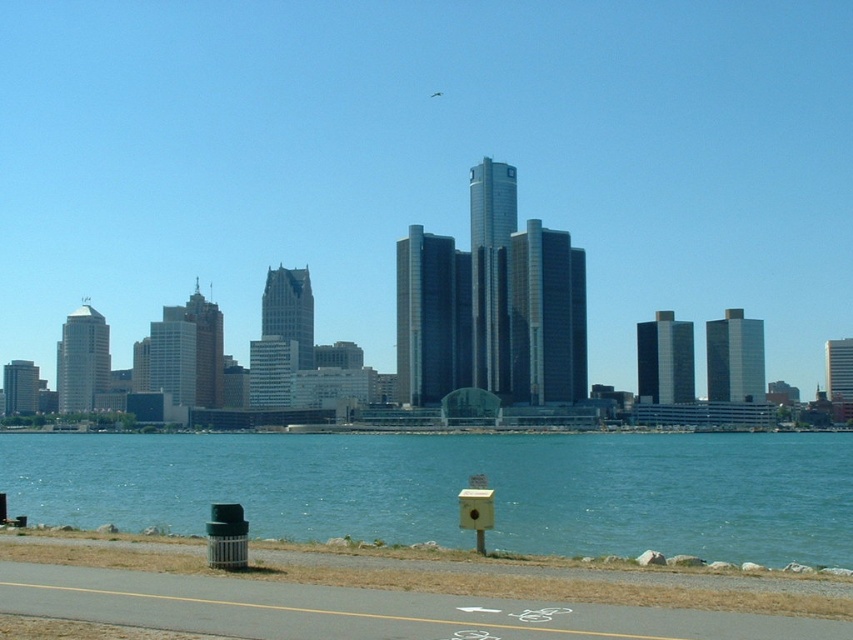
Question: Among these points, which one is farthest from the camera?

Choices:
 (A) (244, 616)
 (B) (270, 522)

Answer: (B)

Question: Is blue water at lower center to the left of gray asphalt bike path at lower center from the viewer's perspective?

Choices:
 (A) no
 (B) yes

Answer: (A)

Question: Which of the following is the closest to the observer?

Choices:
 (A) (573, 529)
 (B) (302, 614)

Answer: (B)

Question: Does blue water at lower center lie in front of gray asphalt bike path at lower center?

Choices:
 (A) yes
 (B) no

Answer: (B)

Question: Considering the relative positions of blue water at lower center and gray asphalt bike path at lower center in the image provided, where is blue water at lower center located with respect to gray asphalt bike path at lower center?

Choices:
 (A) left
 (B) right

Answer: (B)